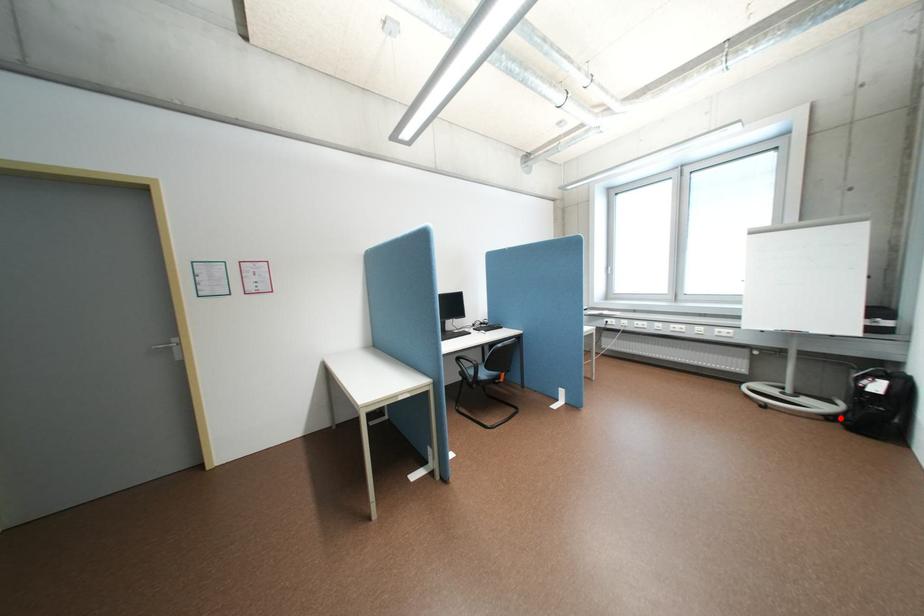
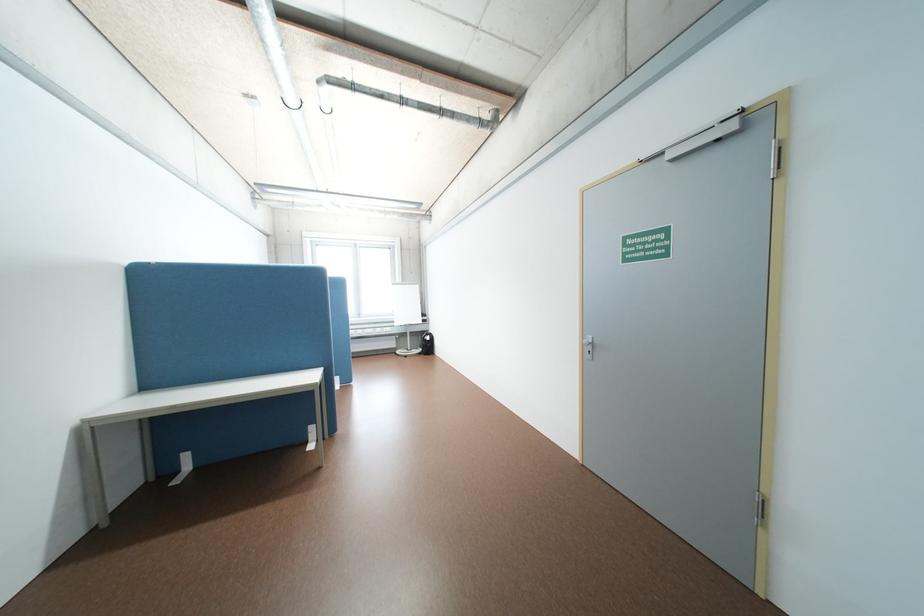
Question: I am providing you with two images of the same scene from different viewpoints. A red point is shown in image1. For the corresponding object point in image2, is it positioned nearer or farther from the camera?

Choices:
 (A) Nearer
 (B) Farther

Answer: (B)